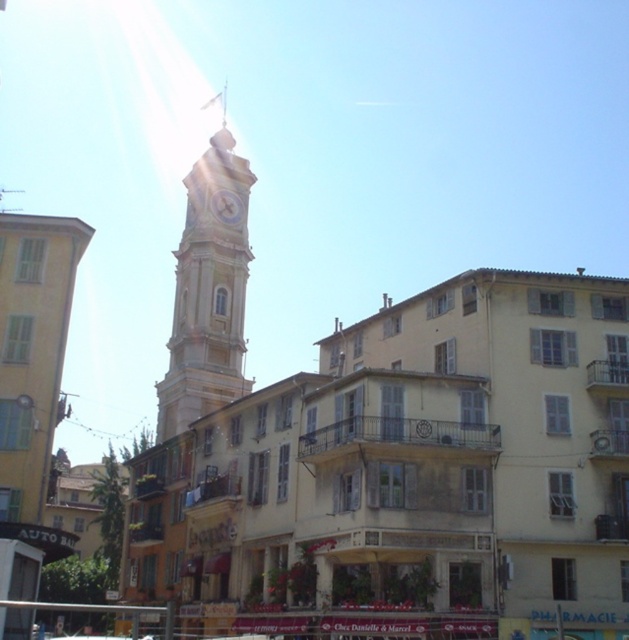
Who is positioned more to the left, light beige stone clock tower at center or white glossy clock at center?

Positioned to the left is light beige stone clock tower at center.

Who is taller, light beige stone clock tower at center or white glossy clock at center?

Standing taller between the two is light beige stone clock tower at center.

Locate an element on the screen. Image resolution: width=629 pixels, height=640 pixels. light beige stone clock tower at center is located at coordinates (208, 292).